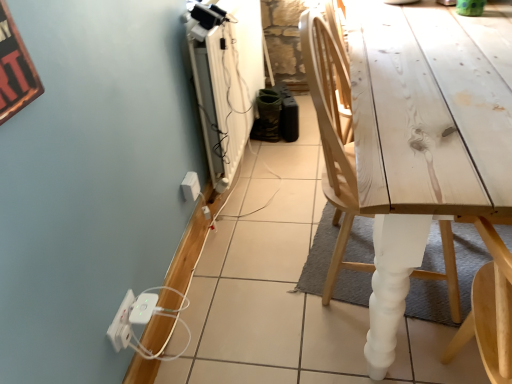
Question: Is white plastic electric outlet at lower left, the 2th electric outlet from the left, taller or shorter than white plastic power strip at lower left, acting as the 1th electric outlet starting from the front?

Choices:
 (A) short
 (B) tall

Answer: (B)

Question: Is white plastic electric outlet at lower left, which is the first electric outlet from top to bottom, bigger or smaller than white plastic power strip at lower left, acting as the 1th electric outlet starting from the front?

Choices:
 (A) big
 (B) small

Answer: (A)

Question: Estimate the real-world distances between objects in this image. Which object is closer to the natural wood chair at right?

Choices:
 (A) white plastic electric outlet at lower left, acting as the second electric outlet starting from the front
 (B) white plastic extension cord at lower left
 (C) white plastic power strip at lower left, which is counted as the 1th electric outlet, starting from the bottom

Answer: (A)

Question: Based on their relative distances, which object is nearer to the natural wood chair at right?

Choices:
 (A) white plastic power strip at lower left, acting as the 1th electric outlet starting from the left
 (B) white plastic electric outlet at lower left, the second electric outlet when ordered from bottom to top
 (C) white plastic extension cord at lower left

Answer: (B)